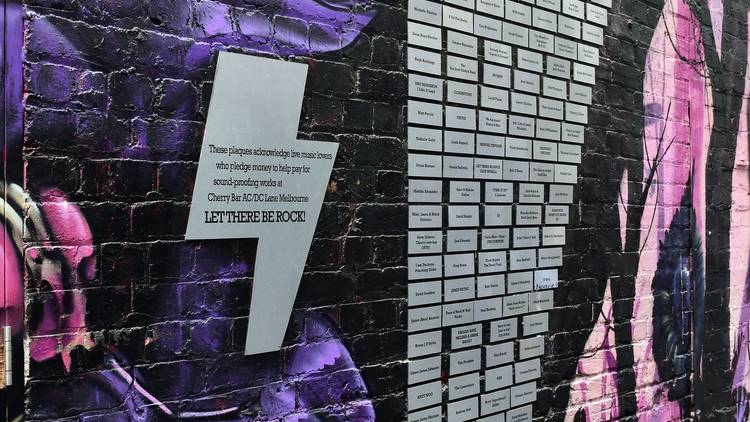
Find the location of `sound-proofing works of`. sound-proofing works of is located at coordinates (214, 184), (280, 184).